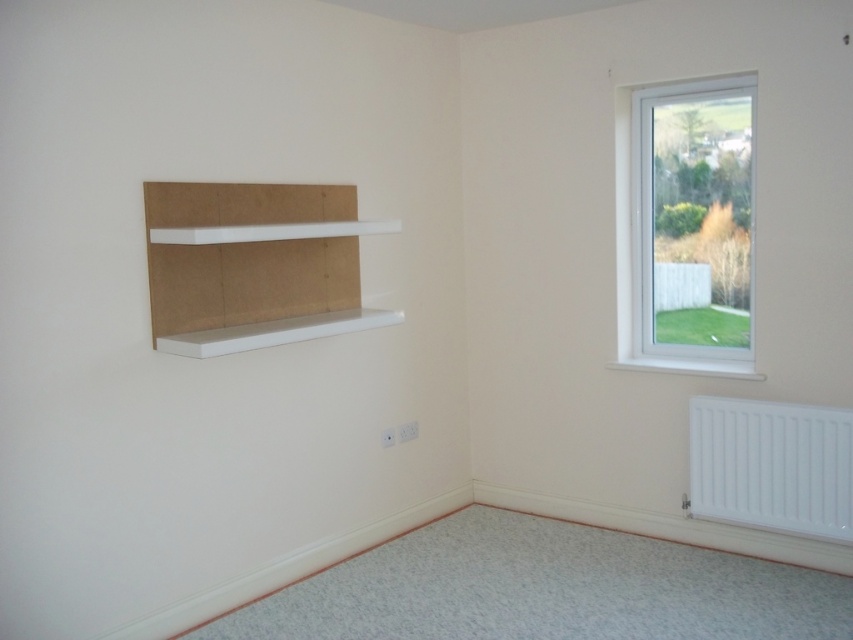
In the scene shown: You are an interior designer planning to place a new piece of furniture in this room. You have a choice between placing a wide sofa or a narrow table. The white plastic window at upper right and the white cardboard bookshelf at left are already in the room. Which object would you choose to place the sofa next to, considering their widths?

You should place the sofa next to the white cardboard bookshelf at left because it has a greater width compared to the white plastic window at upper right, providing more space for the sofa.

You are trying to determine where to place a new potted plant. You have two options in the room shown. The first option is near the white cardboard bookshelf at left, which is made of unfinished wood. The second option is under the white plastic window at upper right, which provides sunlight. Based on the objects in the scene, which location would be better for the plant to receive natural light?

The white plastic window at upper right is positioned over the white cardboard bookshelf at left, so placing the plant under the window would provide better natural light compared to the bookshelf area.